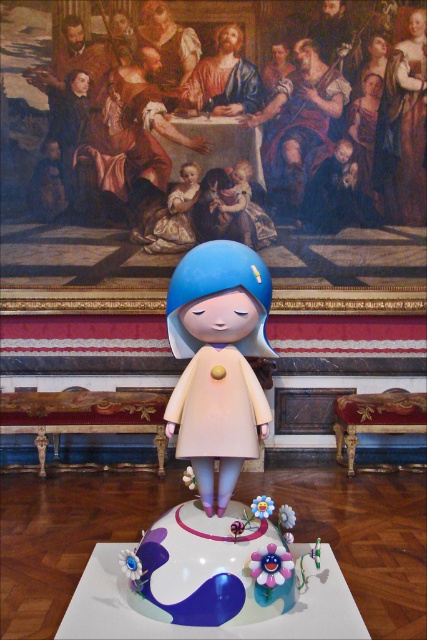
Which is in front, point (213, 333) or point (195, 556)?

Positioned in front is point (195, 556).

Between matte blue doll at center and matte blue cake at center, which one appears on the right side from the viewer's perspective?

→ From the viewer's perspective, matte blue cake at center appears more on the right side.

Between point (195, 436) and point (172, 580), which one is positioned behind?

Point (195, 436)

Find the location of `matte blue doll at center`. matte blue doll at center is located at coordinates (218, 362).